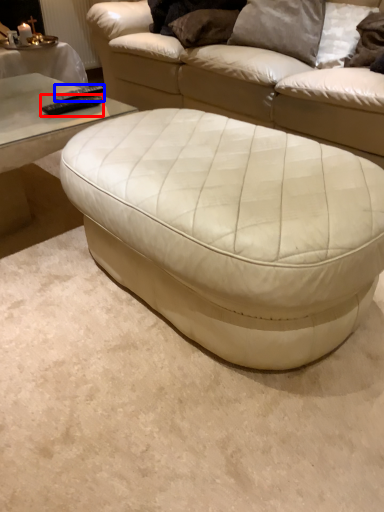
Question: Which of the following is the closest to the observer, remote (highlighted by a red box) or remote (highlighted by a blue box)?

Choices:
 (A) remote
 (B) remote

Answer: (A)